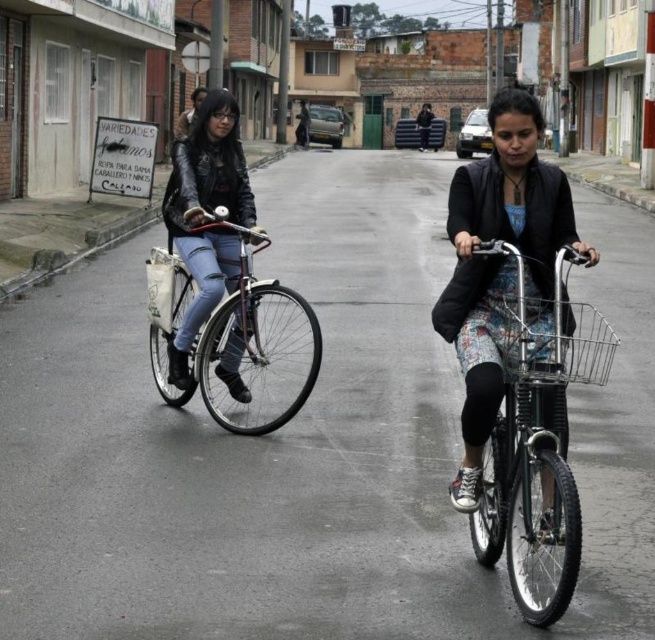
Which of these two, metallic silver bicycle at center or metallic wire basket at center, stands taller?

metallic silver bicycle at center

This screenshot has height=640, width=655. I want to click on metallic silver bicycle at center, so click(x=534, y=433).

Based on the photo, is floral dress at center thinner than leather jacket at center?

No.

Is floral dress at center below leather jacket at center?

Indeed, floral dress at center is positioned under leather jacket at center.

This screenshot has height=640, width=655. What do you see at coordinates (500, 264) in the screenshot? I see `floral dress at center` at bounding box center [500, 264].

Identify the location of floral dress at center. The width and height of the screenshot is (655, 640). (500, 264).

Which is below, metallic silver bicycle at center or leather jacket at center?

metallic silver bicycle at center is below.

Can you confirm if metallic silver bicycle at center is bigger than leather jacket at center?

No, metallic silver bicycle at center is not bigger than leather jacket at center.

I want to click on metallic silver bicycle at center, so click(x=534, y=433).

The image size is (655, 640). Identify the location of metallic silver bicycle at center. (534, 433).